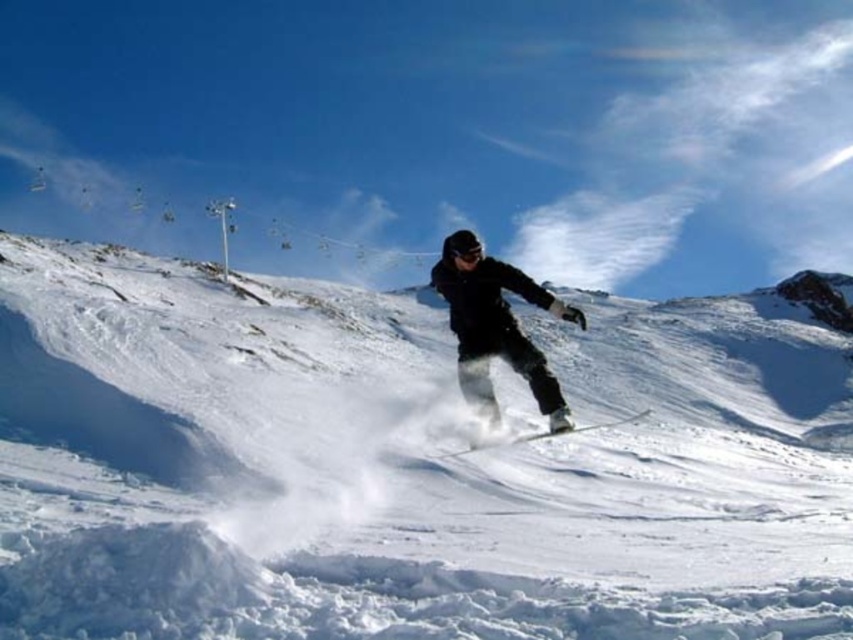
Measure the distance between white fluffy snow at center and camera.

They are 74.61 meters apart.

Between white fluffy snow at center and black matte snowboarder at center, which one appears on the right side from the viewer's perspective?

Positioned to the right is black matte snowboarder at center.

At what (x,y) coordinates should I click in order to perform the action: click on white fluffy snow at center. Please return your answer as a coordinate pair (x, y). Looking at the image, I should click on (405, 465).

Is white fluffy snow at center shorter than white matte ski at center?

No.

Locate an element on the screen. white fluffy snow at center is located at coordinates click(405, 465).

Find the location of a particular element. This screenshot has height=640, width=853. black matte snowboarder at center is located at coordinates (496, 326).

Looking at this image, does black matte snowboarder at center appear on the left side of white matte ski at center?

Correct, you'll find black matte snowboarder at center to the left of white matte ski at center.

Which is in front, point (537, 288) or point (474, 444)?

Point (474, 444) is in front.

At what (x,y) coordinates should I click in order to perform the action: click on black matte snowboarder at center. Please return your answer as a coordinate pair (x, y). This screenshot has width=853, height=640. Looking at the image, I should click on (496, 326).